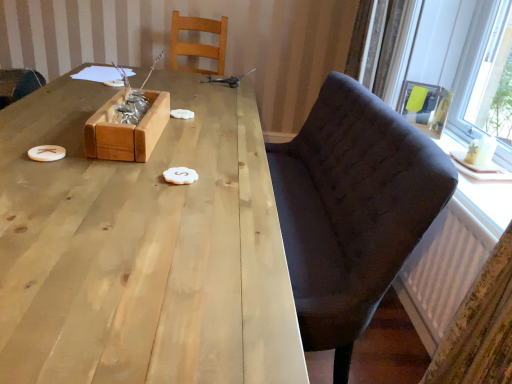
This screenshot has width=512, height=384. In order to click on free space in front of white matte cookie at center, acting as the 2th food starting from the front in this screenshot , I will do `click(186, 131)`.